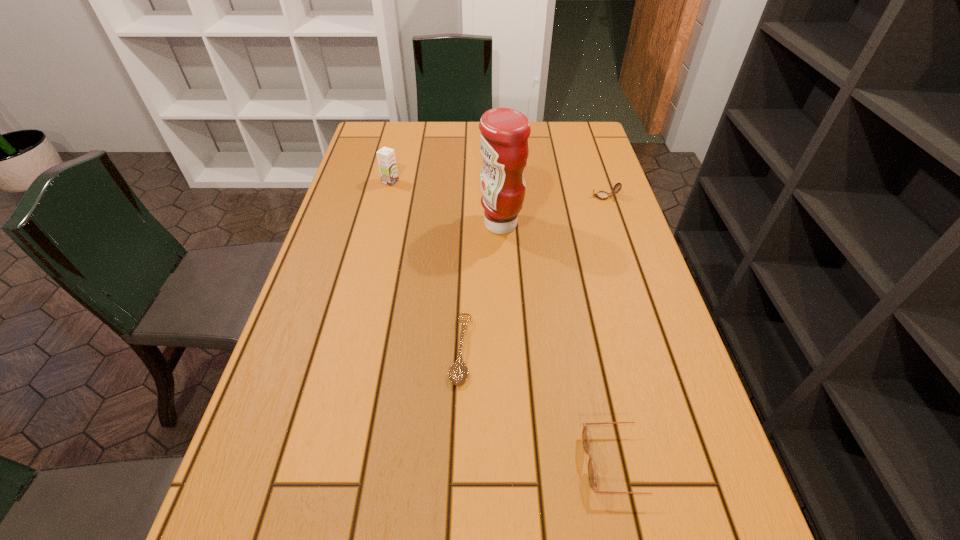
Locate an element on the screen. This screenshot has width=960, height=540. free point between the rightmost object and the condiment is located at coordinates [553, 211].

The height and width of the screenshot is (540, 960). I want to click on vacant space that's between the nearest object and the compass, so click(x=612, y=329).

Where is `vacant area that lies between the tallest object and the sunglasses`? This screenshot has width=960, height=540. vacant area that lies between the tallest object and the sunglasses is located at coordinates (561, 343).

The width and height of the screenshot is (960, 540). Find the location of `vacant point located between the tallest object and the second nearest object`. vacant point located between the tallest object and the second nearest object is located at coordinates (480, 287).

This screenshot has height=540, width=960. Find the location of `vacant space that's between the third nearest object and the fourth farthest object`. vacant space that's between the third nearest object and the fourth farthest object is located at coordinates (480, 287).

Locate an element on the screen. This screenshot has height=540, width=960. empty space that is in between the rightmost object and the nearest object is located at coordinates (612, 329).

Where is `object that is the fourth closest one to the tallest object`? Image resolution: width=960 pixels, height=540 pixels. object that is the fourth closest one to the tallest object is located at coordinates (585, 436).

The height and width of the screenshot is (540, 960). Find the location of `object that is the closest to the leftmost object`. object that is the closest to the leftmost object is located at coordinates (504, 146).